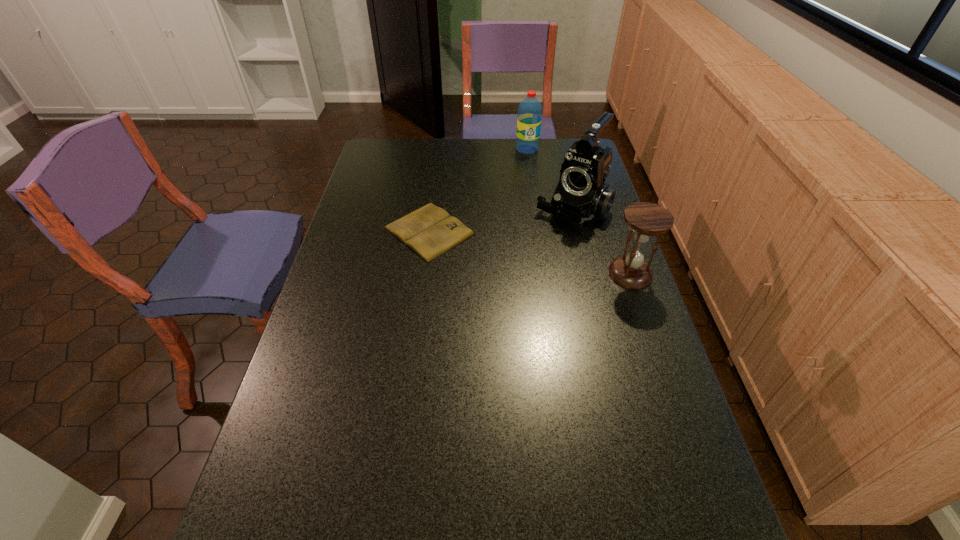
The width and height of the screenshot is (960, 540). In order to click on book in this screenshot , I will do `click(430, 231)`.

This screenshot has height=540, width=960. Find the location of `the shortest object`. the shortest object is located at coordinates (430, 231).

Locate an element on the screen. Image resolution: width=960 pixels, height=540 pixels. hourglass is located at coordinates (646, 219).

Identify the location of the tallest object. This screenshot has width=960, height=540. (581, 194).

In order to click on water bottle in this screenshot , I will do `click(529, 119)`.

Where is `vacant space located 0.400m on the right of the leftmost object`? vacant space located 0.400m on the right of the leftmost object is located at coordinates (595, 231).

The height and width of the screenshot is (540, 960). In order to click on vacant region located 0.360m on the front of the hourglass in this screenshot , I will do pos(674,401).

The image size is (960, 540). In order to click on vacant region located 0.350m on the lens mount of the camcorder in this screenshot , I will do `click(504, 289)`.

The height and width of the screenshot is (540, 960). What are the coordinates of `vacant space located 0.250m on the lens mount of the camcorder` in the screenshot? It's located at (520, 268).

At what (x,y) coordinates should I click in order to perform the action: click on free space located on the lens mount of the camcorder. Please return your answer as a coordinate pair (x, y). The height and width of the screenshot is (540, 960). Looking at the image, I should click on (530, 258).